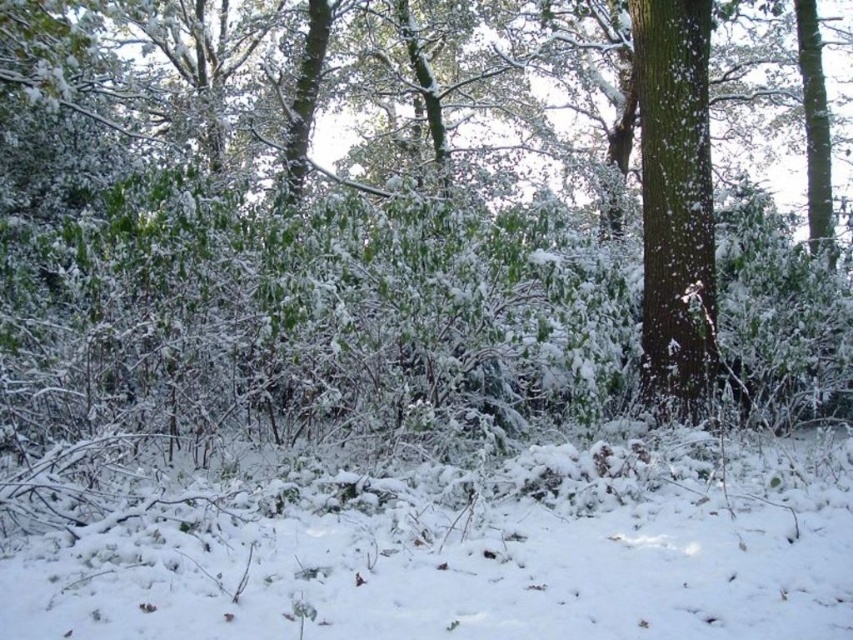
Between white fluffy snow at lower center and green rough bark tree at right, which one appears on the left side from the viewer's perspective?

Positioned to the left is white fluffy snow at lower center.

Between white fluffy snow at lower center and green rough bark tree at right, which one is positioned lower?

white fluffy snow at lower center is below.

Locate an element on the screen. The image size is (853, 640). white fluffy snow at lower center is located at coordinates (474, 552).